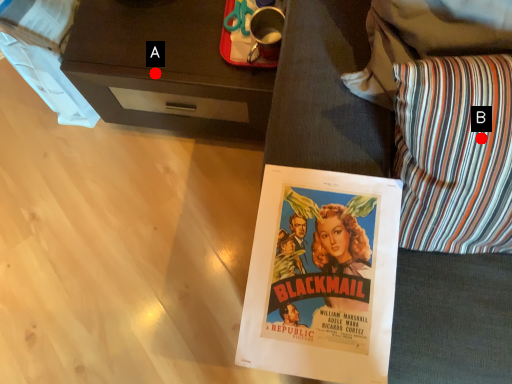
Question: Two points are circled on the image, labeled by A and B beside each circle. Which of the following is the closest to the observer?

Choices:
 (A) A is closer
 (B) B is closer

Answer: (B)